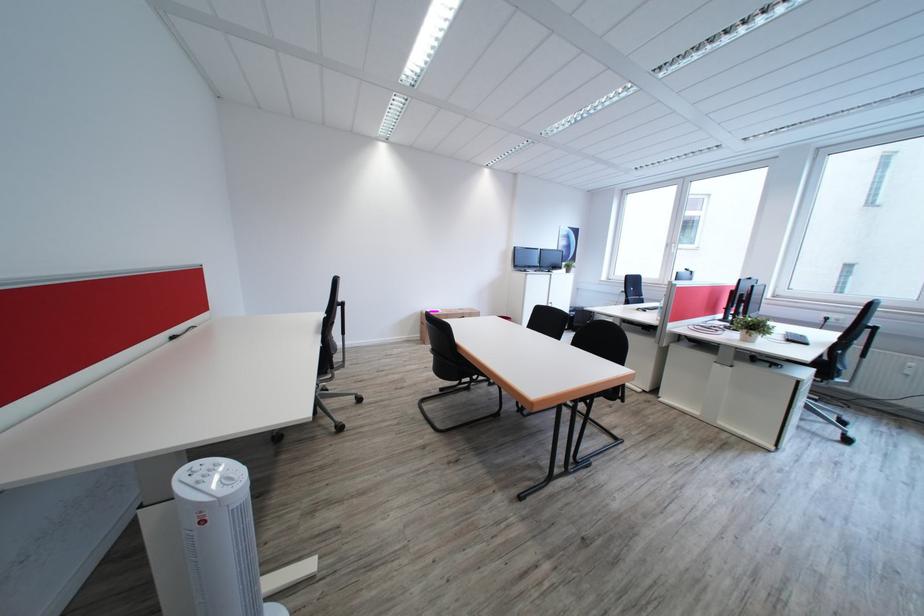
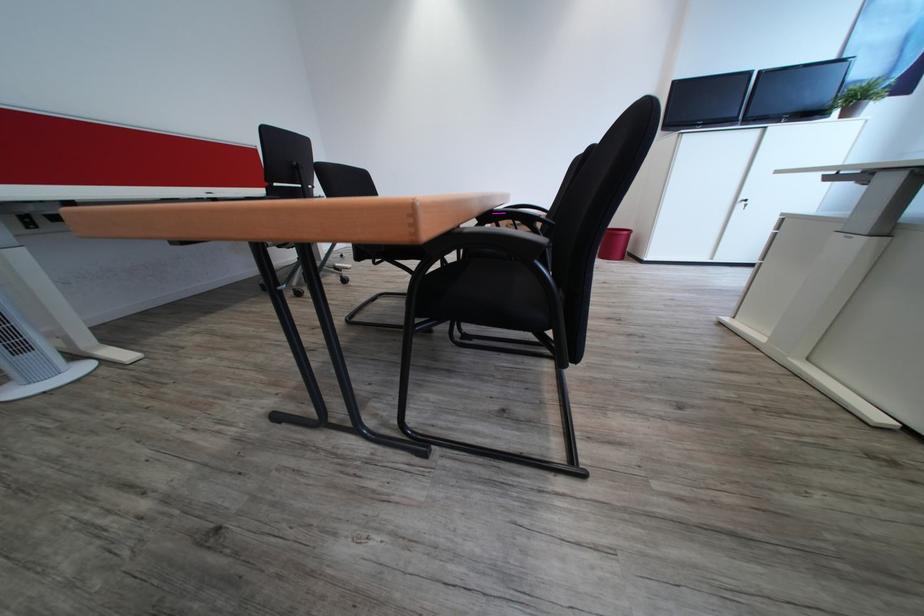
Question: I am providing you with two images of the same scene from different viewpoints. Please identify which objects are invisible in image2.

Choices:
 (A) red trash can
 (B) cardboard box
 (C) black chair sitting surface
 (D) power outlet hub

Answer: (B)